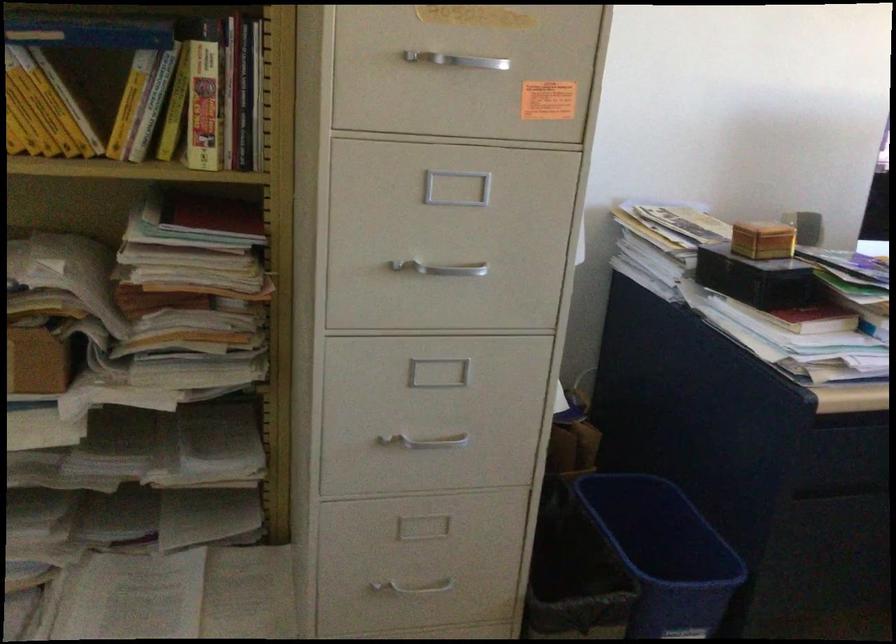
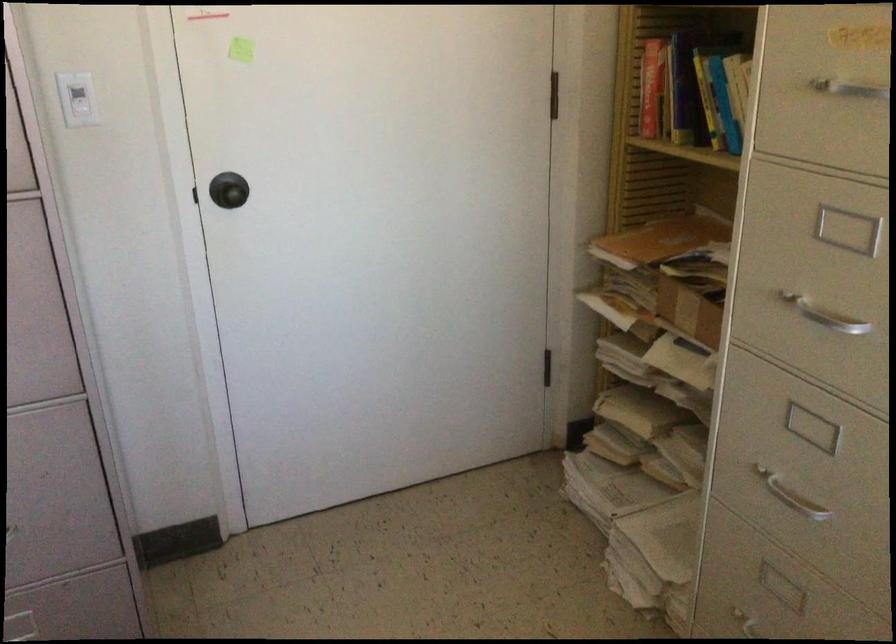
In the second image, find the point that corresponds to the point at 440,259 in the first image.

(824, 315)